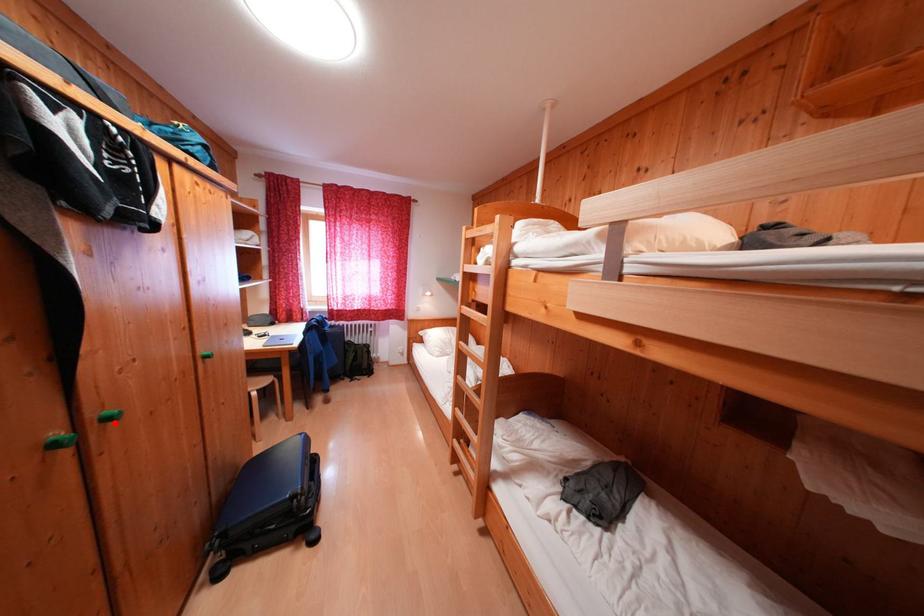
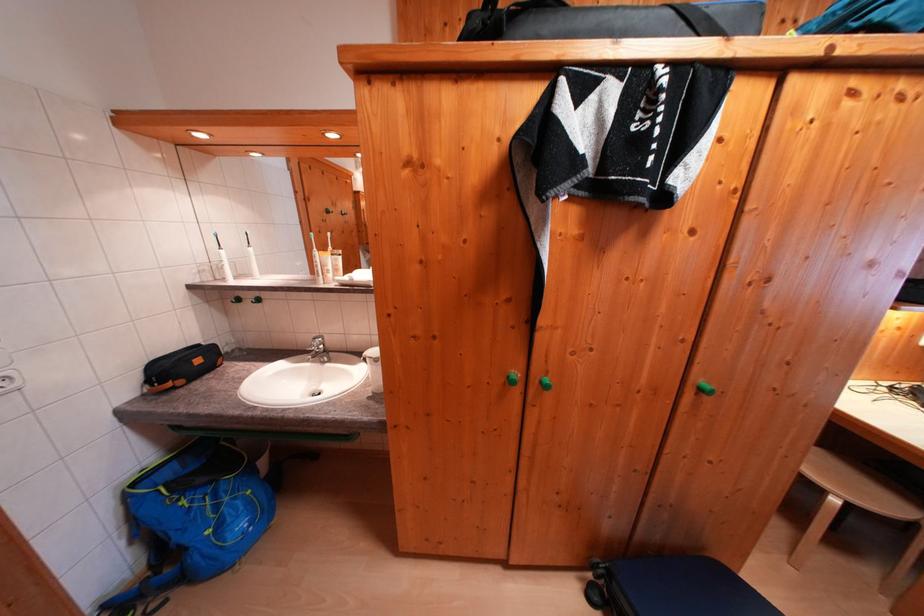
Question: I am providing you with two images of the same scene from different viewpoints. A red point is marked on the first image. Is the red point's position out of view in image 2?

Choices:
 (A) Yes
 (B) No

Answer: (B)